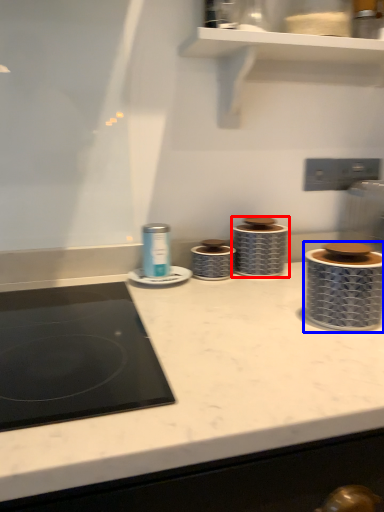
Question: Among these objects, which one is farthest to the camera, appliance (highlighted by a red box) or appliance (highlighted by a blue box)?

Choices:
 (A) appliance
 (B) appliance

Answer: (A)